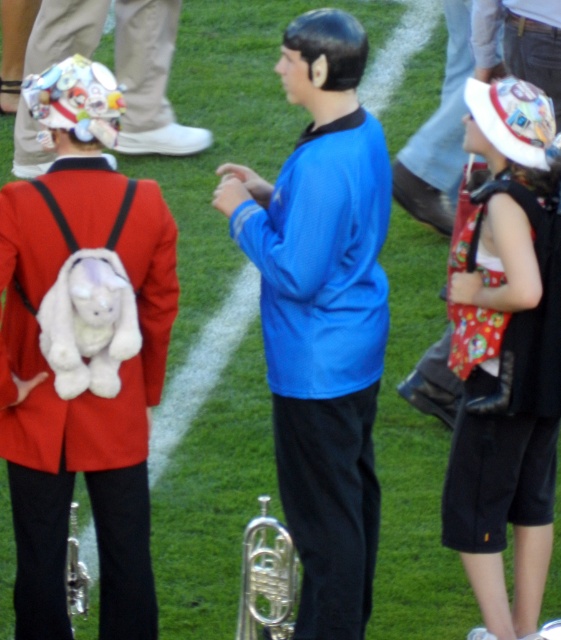
Can you confirm if blue fabric shirt at center is taller than white plush backpack at back?

Yes, blue fabric shirt at center is taller than white plush backpack at back.

Is blue fabric shirt at center to the right of white plush backpack at back from the viewer's perspective?

Indeed, blue fabric shirt at center is positioned on the right side of white plush backpack at back.

Locate an element on the screen. The height and width of the screenshot is (640, 561). blue fabric shirt at center is located at coordinates (325, 355).

How much distance is there between red fabric backpack at right and silver metallic trumpet at center?

red fabric backpack at right is 6.37 feet away from silver metallic trumpet at center.

Does point (546, 410) come closer to viewer compared to point (82, 602)?

Yes.

In order to click on red fabric backpack at right in this screenshot , I will do `click(508, 397)`.

Is white plush backpack at back to the left of matte red jacket at left from the viewer's perspective?

Incorrect, white plush backpack at back is not on the left side of matte red jacket at left.

Does white plush backpack at back have a greater width compared to matte red jacket at left?

Incorrect, white plush backpack at back's width does not surpass matte red jacket at left's.

Between point (59, 486) and point (95, 44), which one is positioned in front?

Point (59, 486) is in front.

Find the location of a particular element. white plush backpack at back is located at coordinates (82, 420).